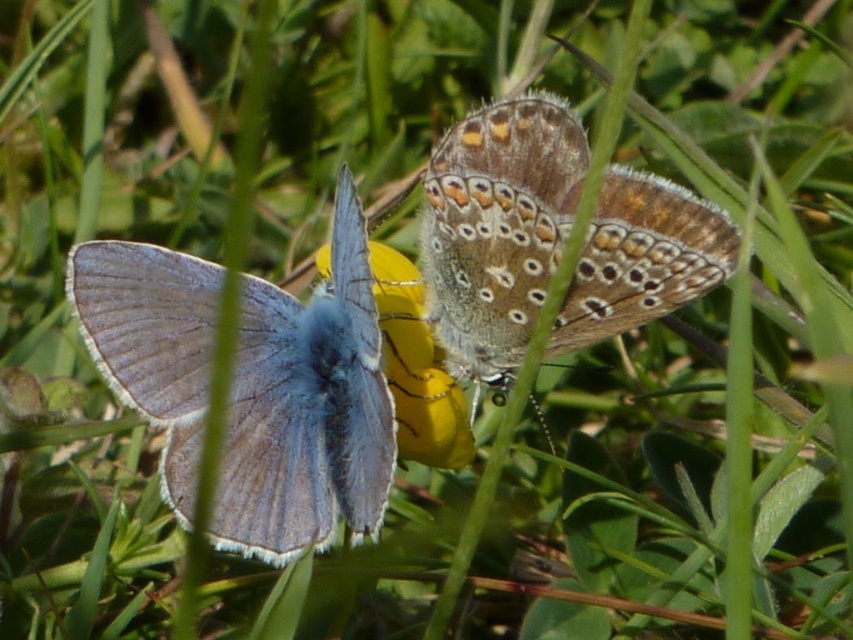
Who is more forward, (453, 321) or (433, 397)?

Point (433, 397)

Who is lower down, brown speckled wings at center or yellow matte flower at center?

yellow matte flower at center is below.

Does point (715, 264) come closer to viewer compared to point (409, 368)?

That is True.

Locate an element on the screen. brown speckled wings at center is located at coordinates (497, 230).

Between point (259, 365) and point (390, 291), which one is positioned behind?

Positioned behind is point (390, 291).

At what (x,y) coordinates should I click in order to perform the action: click on matte blue butterfly at left. Please return your answer as a coordinate pair (x, y). Looking at the image, I should click on (306, 410).

Based on the photo, is matte blue butterfly at left wider than brown speckled wings at center?

Correct, the width of matte blue butterfly at left exceeds that of brown speckled wings at center.

Does point (256, 342) come behind point (549, 253)?

Yes, point (256, 342) is farther from viewer.

The image size is (853, 640). What do you see at coordinates (306, 410) in the screenshot? I see `matte blue butterfly at left` at bounding box center [306, 410].

Locate an element on the screen. The width and height of the screenshot is (853, 640). matte blue butterfly at left is located at coordinates (306, 410).